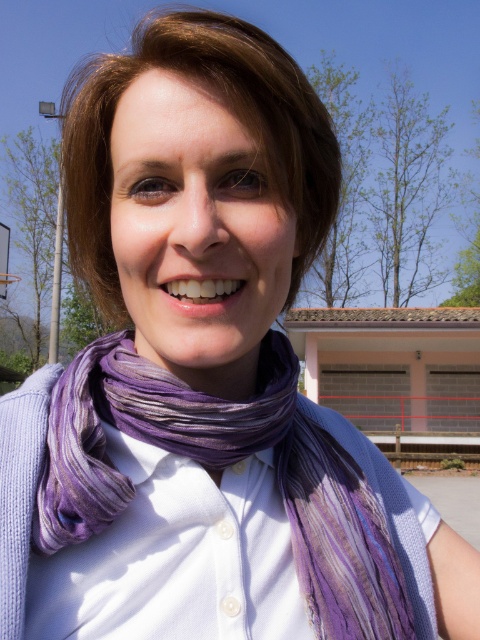
Is purple silk scarf at center above purple striped scarf at center?

No, purple silk scarf at center is not above purple striped scarf at center.

Does point (301, 556) lie behind point (254, 353)?

No, it is in front of (254, 353).

Is point (68, 480) behind point (230, 387)?

No, (68, 480) is in front of (230, 387).

At what (x,y) coordinates should I click in order to perform the action: click on purple silk scarf at center. Please return your answer as a coordinate pair (x, y). The image size is (480, 640). Looking at the image, I should click on (223, 470).